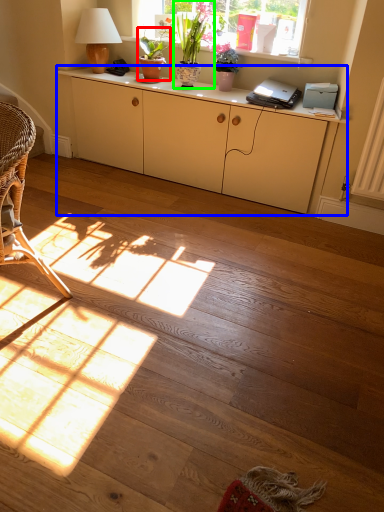
Question: Based on their relative distances, which object is farther from houseplant (highlighted by a red box)? Choose from cabinetry (highlighted by a blue box) and houseplant (highlighted by a green box).

Choices:
 (A) cabinetry
 (B) houseplant

Answer: (A)